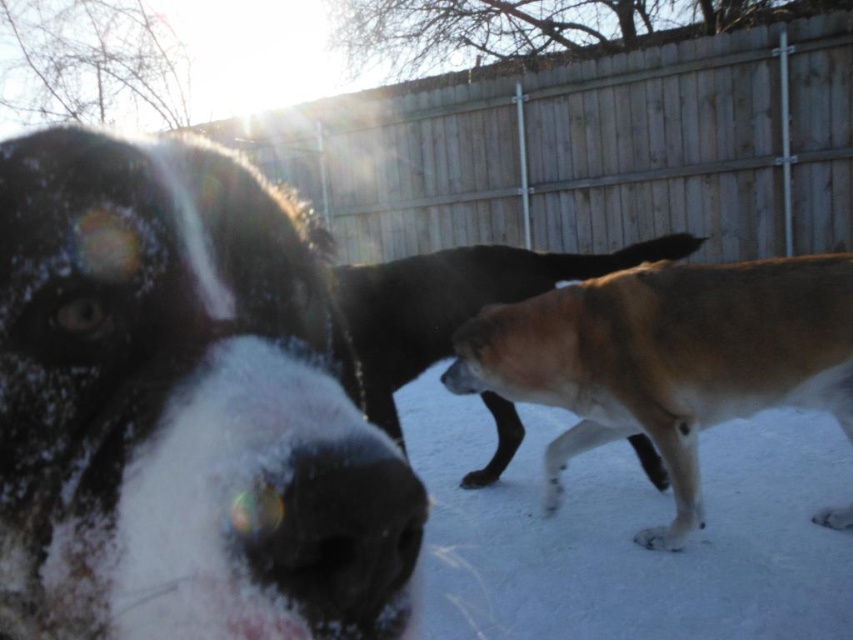
You are standing in the snowy outdoor scene and want to walk towards the wooden fence at center. Which direction should you head?

The wooden fence at center is located at point (x=585, y=150), so you should head towards the center of the image to reach it.

Looking at the snowy scene with the three dogs, where is the wooden fence at center in relation to the black matte nose at center?

The wooden fence at center is to the right of the black matte nose at center.